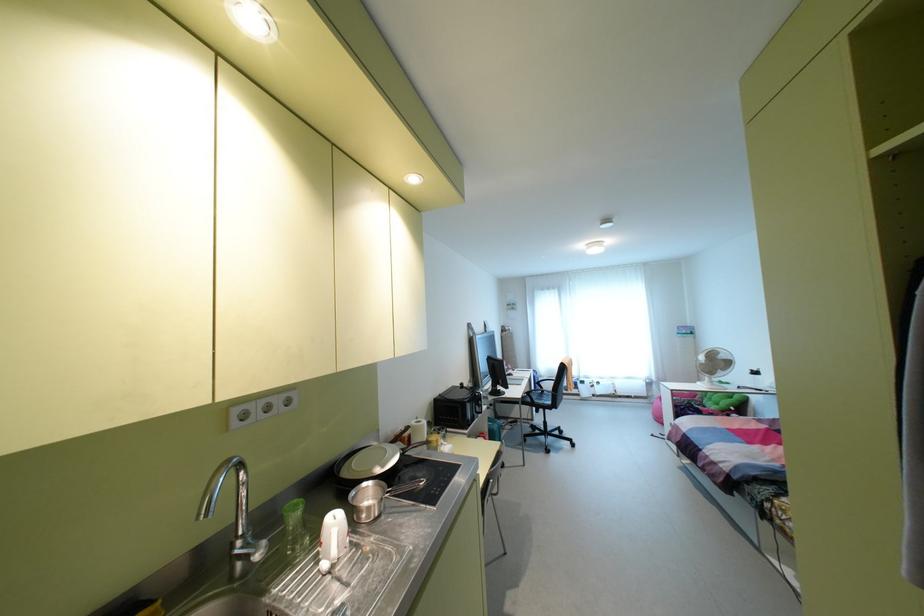
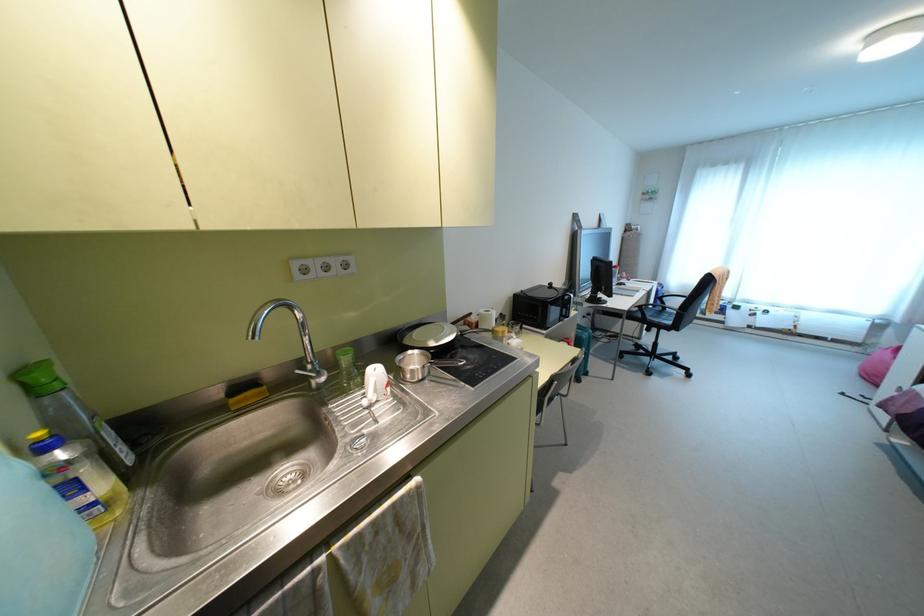
In the second image, find the point that corresponds to pixel 323 565 in the first image.

(365, 400)